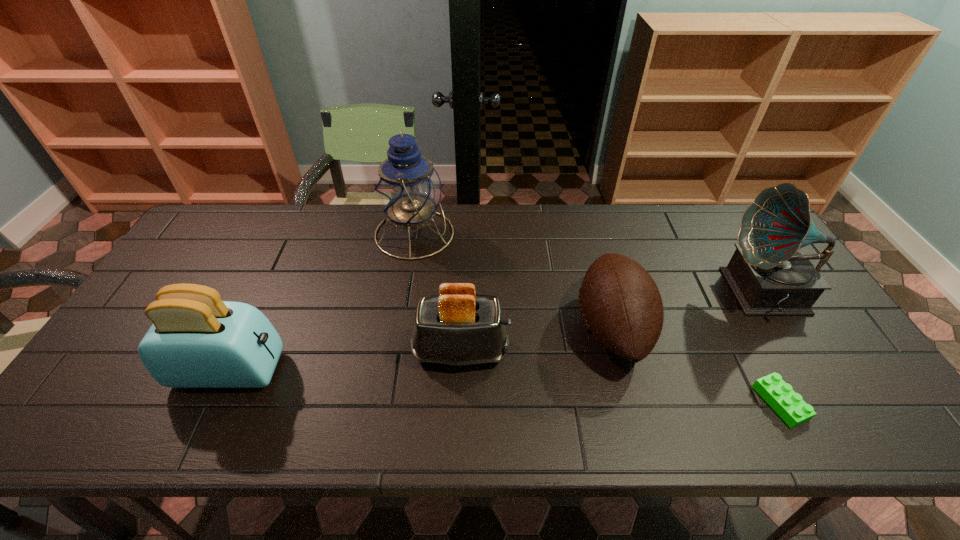
Find the location of `the farthest object`. the farthest object is located at coordinates (408, 189).

Locate an element on the screen. record player is located at coordinates (769, 274).

At what (x,y) coordinates should I click in order to perform the action: click on the leftmost object. Please return your answer as a coordinate pair (x, y). Looking at the image, I should click on (196, 340).

Find the location of a particular element. the third tallest object is located at coordinates (196, 340).

This screenshot has height=540, width=960. What are the coordinates of `the right toaster` in the screenshot? It's located at (458, 328).

The image size is (960, 540). In order to click on the third object from right to left in this screenshot , I will do `click(621, 306)`.

Find the location of a particular element. This screenshot has height=540, width=960. the fifth tallest object is located at coordinates (621, 306).

Where is `the shortest object`? This screenshot has width=960, height=540. the shortest object is located at coordinates (779, 395).

Locate an element on the screen. The width and height of the screenshot is (960, 540). free space located 0.160m on the front-facing side of the lantern is located at coordinates (503, 234).

Find the location of a particular element. vacant space located on the horn of the record player is located at coordinates (617, 294).